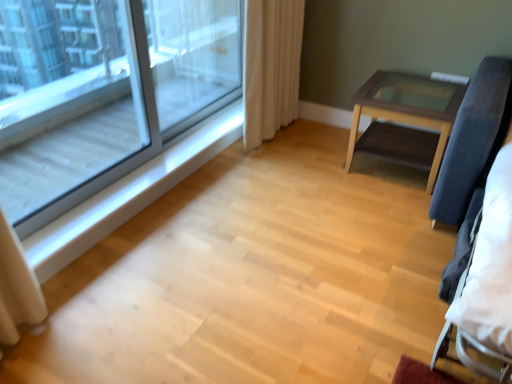
Identify the location of white wood at left. (130, 193).

The image size is (512, 384). I want to click on white wood at left, so click(x=130, y=193).

Would you say beige fabric curtain at upper right is a long distance from transparent glass screen door at upper left?

No, beige fabric curtain at upper right is not far away from transparent glass screen door at upper left.

From a real-world perspective, relative to transparent glass screen door at upper left, is beige fabric curtain at upper right vertically above or below?

Clearly, from a real-world perspective, beige fabric curtain at upper right is below transparent glass screen door at upper left.

Considering the sizes of objects beige fabric curtain at upper right and transparent glass screen door at upper left in the image provided, who is wider, beige fabric curtain at upper right or transparent glass screen door at upper left?

With larger width is beige fabric curtain at upper right.

In the image, is beige fabric curtain at upper right on the left side or the right side of transparent glass screen door at upper left?

Clearly, beige fabric curtain at upper right is on the right of transparent glass screen door at upper left in the image.

Would you say transparent glass screen door at upper left is outside clear glass window at upper left?

Indeed, transparent glass screen door at upper left is completely outside clear glass window at upper left.

Which is more distant, (201, 72) or (141, 72)?

The point (201, 72) is farther.

Does transparent glass screen door at upper left turn towards clear glass window at upper left?

Yes, transparent glass screen door at upper left is aimed at clear glass window at upper left.

Which of these two, transparent glass screen door at upper left or clear glass window at upper left, is bigger?

Bigger between the two is transparent glass screen door at upper left.

Based on the photo, visually, is transparent glass screen door at upper left positioned to the left or to the right of white wood at left?

From the image, it's evident that transparent glass screen door at upper left is to the right of white wood at left.

Can you tell me how much transparent glass screen door at upper left and white wood at left differ in facing direction?

They differ by 1.98 degrees in their facing directions.

Is transparent glass screen door at upper left far from white wood at left?

No, there isn't a large distance between transparent glass screen door at upper left and white wood at left.

Which point is more distant from viewer, (206, 25) or (81, 231)?

The point (206, 25) is more distant.

Does wooden glass-top table at right turn towards beige fabric curtain at upper right?

No, wooden glass-top table at right is not oriented towards beige fabric curtain at upper right.

From a real-world perspective, which object stands above the other?

In real-world perspective, beige fabric curtain at upper right is above.

Locate an element on the screen. curtain behind the wooden glass-top table at right is located at coordinates (271, 67).

Relative to beige fabric curtain at upper right, is wooden glass-top table at right in front or behind?

wooden glass-top table at right is positioned closer to the viewer than beige fabric curtain at upper right.

Is wooden glass-top table at right not inside white wood at left?

wooden glass-top table at right is positioned outside white wood at left.

Which of these two, wooden glass-top table at right or white wood at left, is bigger?

Bigger between the two is wooden glass-top table at right.

Does point (370, 103) lie behind point (181, 140)?

No, (370, 103) is in front of (181, 140).

Who is shorter, wooden glass-top table at right or white wood at left?

white wood at left.

Which is in front, point (287, 92) or point (379, 141)?

Positioned in front is point (379, 141).

Based on their positions, is beige fabric curtain at upper right located to the left or right of wooden glass-top table at right?

beige fabric curtain at upper right is to the left of wooden glass-top table at right.

At what (x,y) coordinates should I click in order to perform the action: click on curtain above the wooden glass-top table at right (from the image's perspective). Please return your answer as a coordinate pair (x, y). Looking at the image, I should click on (271, 67).

From a real-world perspective, is transparent glass screen door at upper left physically located above or below beige fabric curtain at upper right?

In terms of real-world spatial position, transparent glass screen door at upper left is above beige fabric curtain at upper right.

I want to click on screen door that appears above the beige fabric curtain at upper right (from a real-world perspective), so pos(193,58).

Is transparent glass screen door at upper left beside beige fabric curtain at upper right?

transparent glass screen door at upper left is not next to beige fabric curtain at upper right, and they're not touching.

Between point (234, 7) and point (283, 59), which one is positioned behind?

The point (234, 7) is more distant.

This screenshot has width=512, height=384. Find the location of `screen door that appears below the beige fabric curtain at upper right (from the image's perspective)`. screen door that appears below the beige fabric curtain at upper right (from the image's perspective) is located at coordinates (193, 58).

Find the location of a particular element. This screenshot has height=384, width=512. screen door that appears below the clear glass window at upper left (from a real-world perspective) is located at coordinates (193, 58).

Based on their spatial positions, is wooden glass-top table at right or transparent glass screen door at upper left closer to clear glass window at upper left?

transparent glass screen door at upper left lies closer to clear glass window at upper left than the other object.

When comparing their distances from beige fabric curtain at upper right, does clear glass window at upper left or transparent glass screen door at upper left seem further?

The object further to beige fabric curtain at upper right is clear glass window at upper left.

Considering their positions, is beige fabric curtain at upper right positioned further to clear glass window at upper left than transparent glass screen door at upper left?

Based on the image, beige fabric curtain at upper right appears to be further to clear glass window at upper left.

Consider the image. From the image, which object appears to be nearer to clear glass window at upper left, beige fabric curtain at upper right or white wood at left?

white wood at left lies closer to clear glass window at upper left than the other object.

When comparing their distances from transparent glass screen door at upper left, does wooden glass-top table at right or white wood at left seem closer?

The object closer to transparent glass screen door at upper left is white wood at left.

Which object lies nearer to the anchor point white wood at left, beige fabric curtain at upper right or clear glass window at upper left?

beige fabric curtain at upper right is closer to white wood at left.

Which object lies nearer to the anchor point white wood at left, clear glass window at upper left or beige fabric curtain at upper right?

beige fabric curtain at upper right is closer to white wood at left.

Which object lies further to the anchor point clear glass window at upper left, white wood at left or beige fabric curtain at upper right?

Among the two, beige fabric curtain at upper right is located further to clear glass window at upper left.

Identify the location of screen door located between white wood at left and wooden glass-top table at right in the left-right direction. Image resolution: width=512 pixels, height=384 pixels. (193, 58).

Image resolution: width=512 pixels, height=384 pixels. I want to click on curtain between transparent glass screen door at upper left and wooden glass-top table at right in the horizontal direction, so tap(271, 67).

Find the location of a particular element. window sill located between clear glass window at upper left and beige fabric curtain at upper right in the depth direction is located at coordinates (130, 193).

You are a GUI agent. You are given a task and a screenshot of the screen. Output one action in this format:
    pyautogui.click(x=<x>, y=<y>)
    Task: Click on the screen door between beige fabric curtain at upper right and white wood at left in the up-down direction
    Image resolution: width=512 pixels, height=384 pixels.
    Given the screenshot: What is the action you would take?
    pyautogui.click(x=193, y=58)